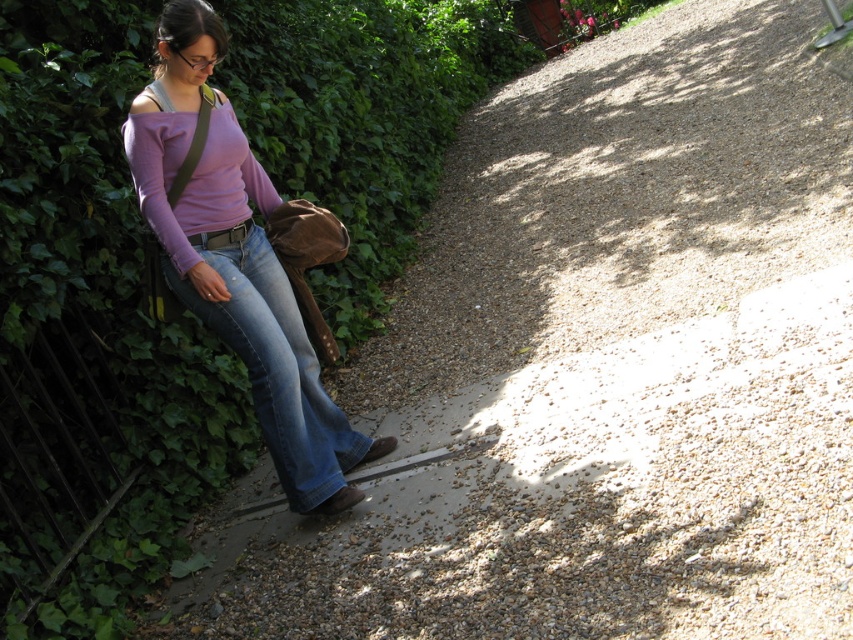
Is denim jeans at left thinner than blue denim jeans at left?

No, denim jeans at left is not thinner than blue denim jeans at left.

Can you confirm if denim jeans at left is wider than blue denim jeans at left?

Yes.

Who is more distant from viewer, (289,321) or (262,397)?

Positioned behind is point (289,321).

You are a GUI agent. You are given a task and a screenshot of the screen. Output one action in this format:
    pyautogui.click(x=<x>, y=<y>)
    Task: Click on the denim jeans at left
    The image size is (853, 640).
    Given the screenshot: What is the action you would take?
    pyautogui.click(x=236, y=260)